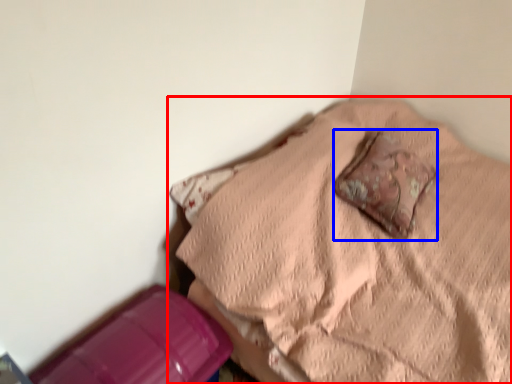
Question: Which object appears farthest to the camera in this image, furniture (highlighted by a red box) or pillow (highlighted by a blue box)?

Choices:
 (A) furniture
 (B) pillow

Answer: (B)